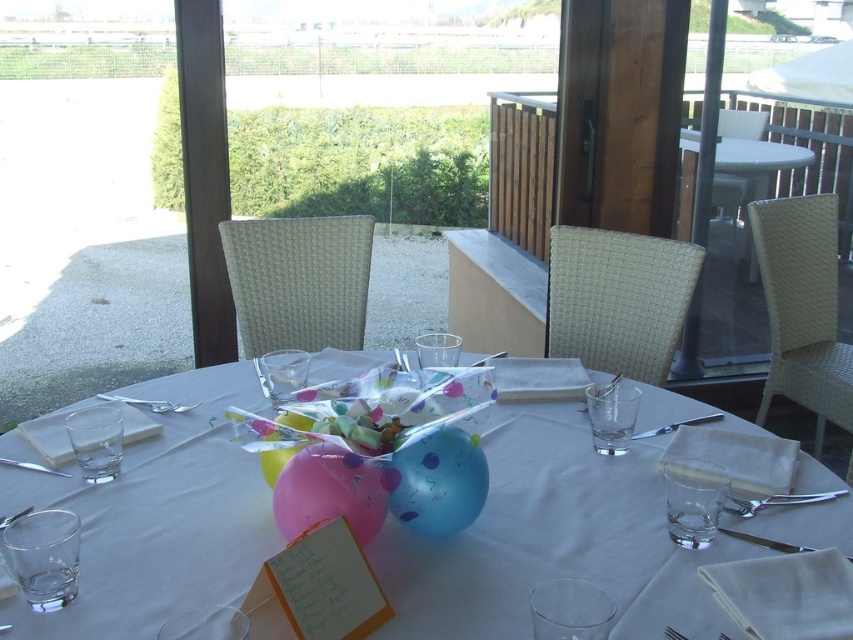
Is point (744, 509) positioned after point (169, 403)?

No.

Who is taller, satin silver fork at lower right or shiny metallic knife at center?

shiny metallic knife at center is taller.

The image size is (853, 640). In order to click on satin silver fork at lower right in this screenshot , I will do `click(776, 500)`.

Looking at this image, who is positioned more to the left, shiny metallic knife at center or brushed metal fork at upper left?

shiny metallic knife at center is more to the left.

From the picture: Is shiny metallic knife at center above brushed metal fork at upper left?

Yes, shiny metallic knife at center is above brushed metal fork at upper left.

What do you see at coordinates (149, 403) in the screenshot? Image resolution: width=853 pixels, height=640 pixels. I see `shiny metallic knife at center` at bounding box center [149, 403].

Locate an element on the screen. The height and width of the screenshot is (640, 853). shiny metallic knife at center is located at coordinates (149, 403).

Between shiny metallic knife at center and satin silver knife at upper center, which one is positioned lower?

satin silver knife at upper center

Is point (126, 401) less distant than point (665, 426)?

No, (126, 401) is further to viewer.

Locate an element on the screen. The width and height of the screenshot is (853, 640). shiny metallic knife at center is located at coordinates (149, 403).